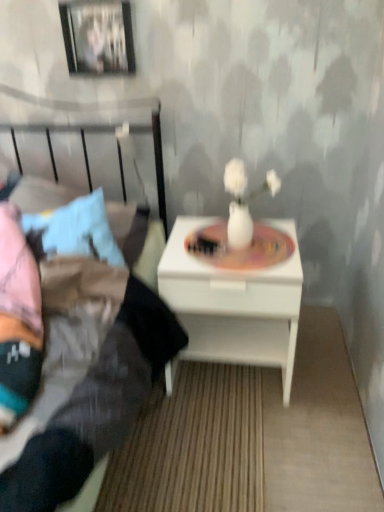
The image size is (384, 512). I want to click on vacant point to the right of white glossy nightstand at center, so click(326, 376).